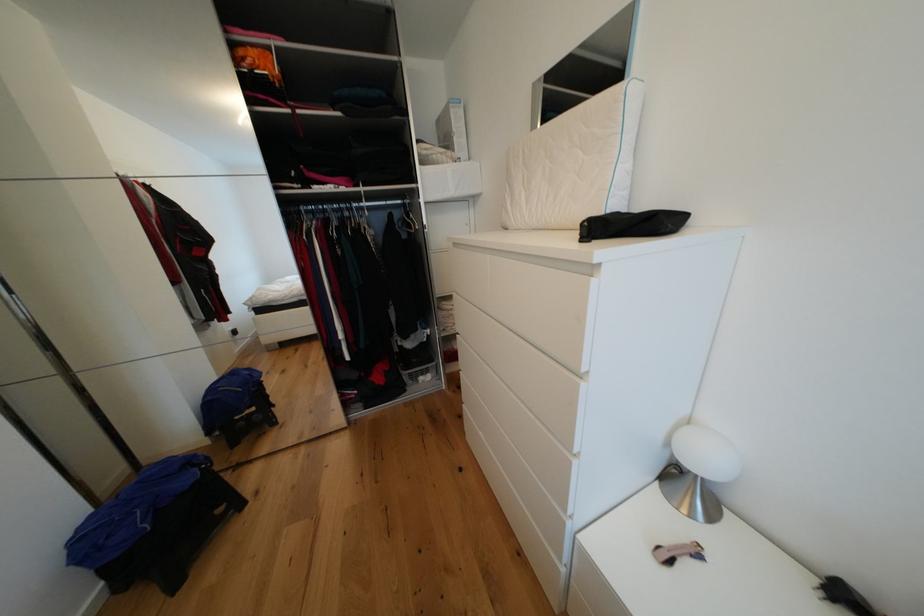
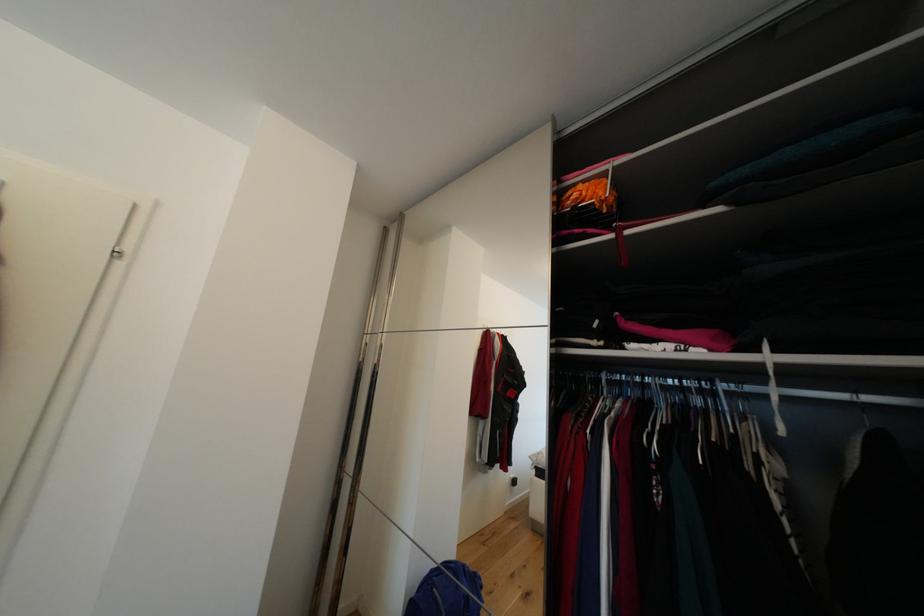
Where in the second image is the point corresponding to (210,405) from the first image?

(421, 592)